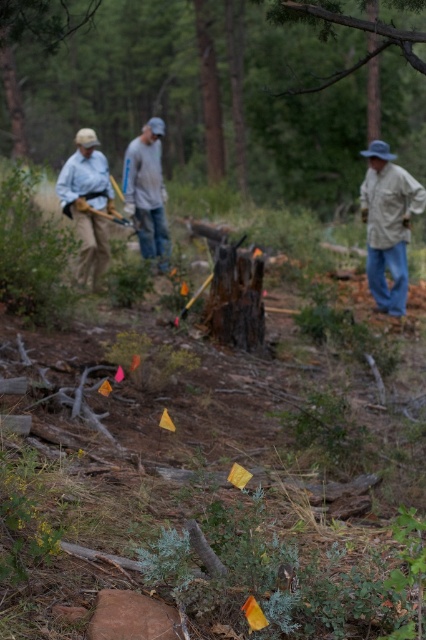
You are part of a team conducting a survey in a forest. You notice two workers wearing the matte blue shirt at left and the gray cotton shirt at center. Which worker is standing closer to you?

The matte blue shirt at left is closer to the viewer than the gray cotton shirt at center, so the worker in the matte blue shirt at left is closer to you.

You are a hiker who needs to choose between two shirts for a day hike in this forested area. The matte blue shirt at left and the gray cotton shirt at center are available. Considering their sizes, which shirt might be more comfortable for carrying a backpack?

The matte blue shirt at left is wider than the gray cotton shirt at center, so it might provide more comfort when carrying a backpack due to its larger size allowing for better movement and fit.

From the picture: You are a surveyor in the forest and need to place a new flag exactly 0.5 meters to the right of the dark brown wood stump at center. Given the coordinates provided in the Objects Description, can you determine the new flag position?

The dark brown wood stump at center is located at point (218, 86). Moving 0.5 meters to the right would place the new flag at coordinates 0.136 plus 0.5 meters in the x direction, so the new position would be (218, 406).